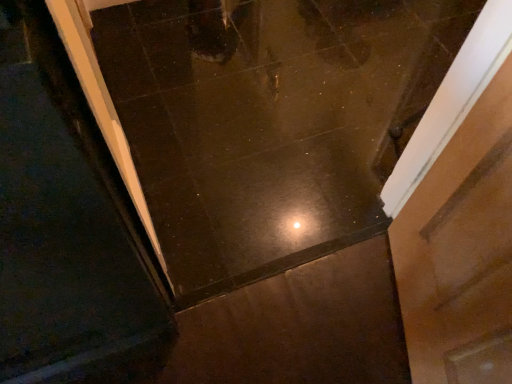
Describe the element at coordinates (65, 225) in the screenshot. The width and height of the screenshot is (512, 384). I see `smooth white door at left` at that location.

You are a GUI agent. You are given a task and a screenshot of the screen. Output one action in this format:
    pyautogui.click(x=<x>, y=<y>)
    Task: Click on the smooth white door at left
    
    Given the screenshot: What is the action you would take?
    pyautogui.click(x=65, y=225)

Identify the location of smooth white door at left. The image size is (512, 384). (65, 225).